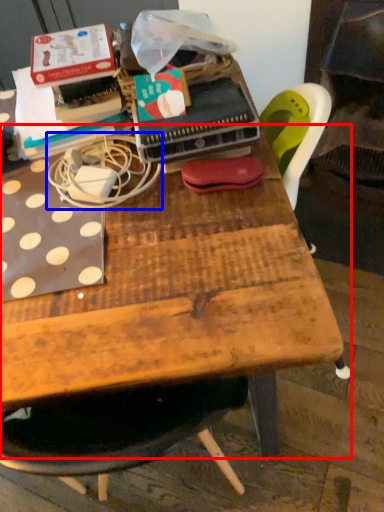
Question: Among these objects, which one is nearest to the camera, table (highlighted by a red box) or string (highlighted by a blue box)?

Choices:
 (A) table
 (B) string

Answer: (B)